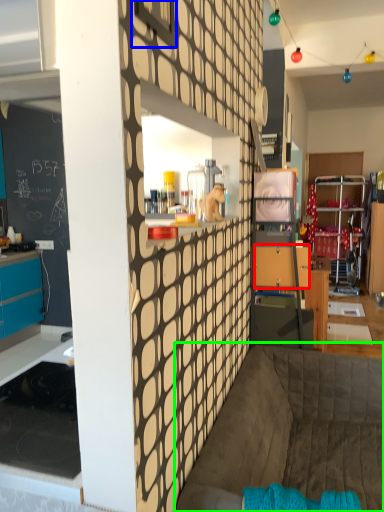
Question: Considering the real-world distances, which object is farthest from drawer (highlighted by a red box)? window (highlighted by a blue box) or couch (highlighted by a green box)?

Choices:
 (A) window
 (B) couch

Answer: (A)